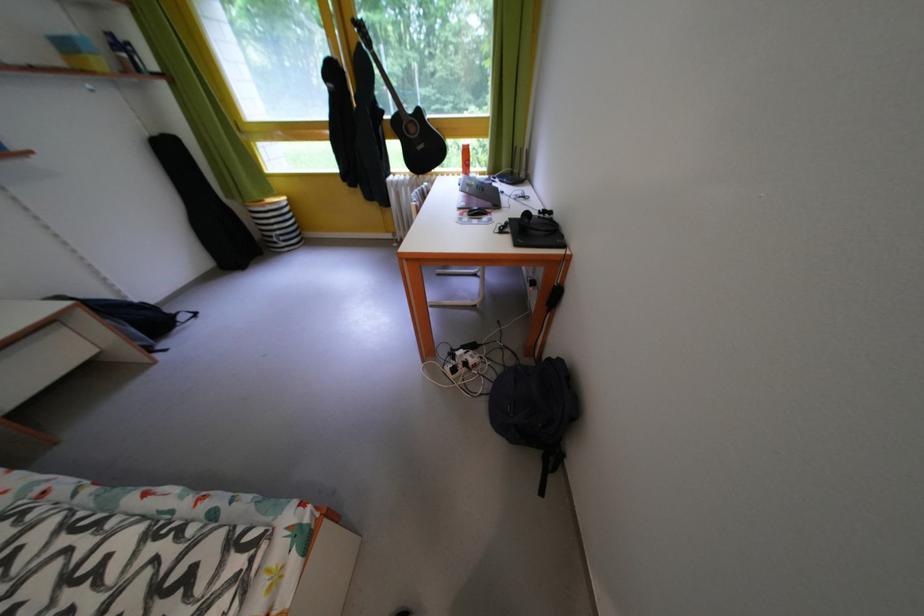
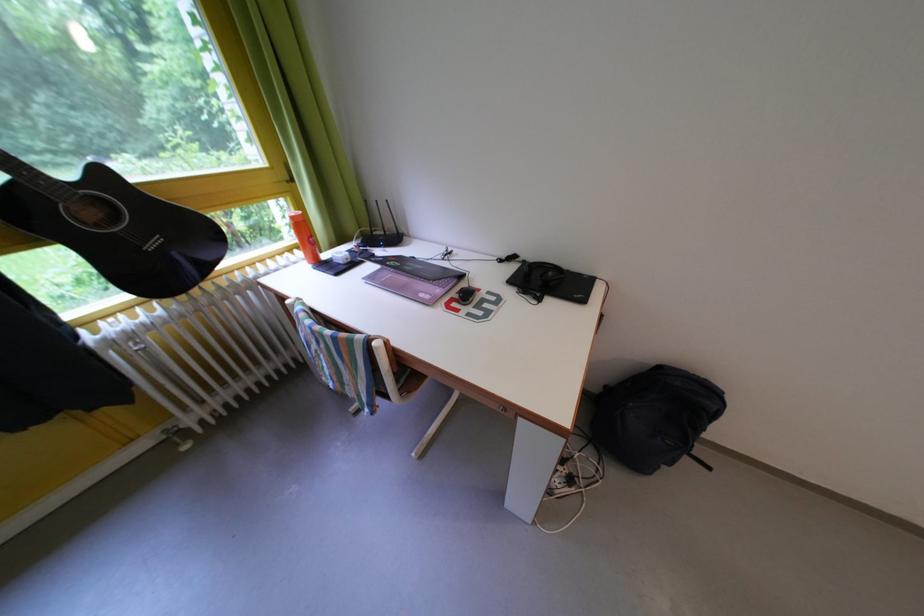
Where in the second image is the point corresponding to point (511, 195) from the first image?

(417, 261)